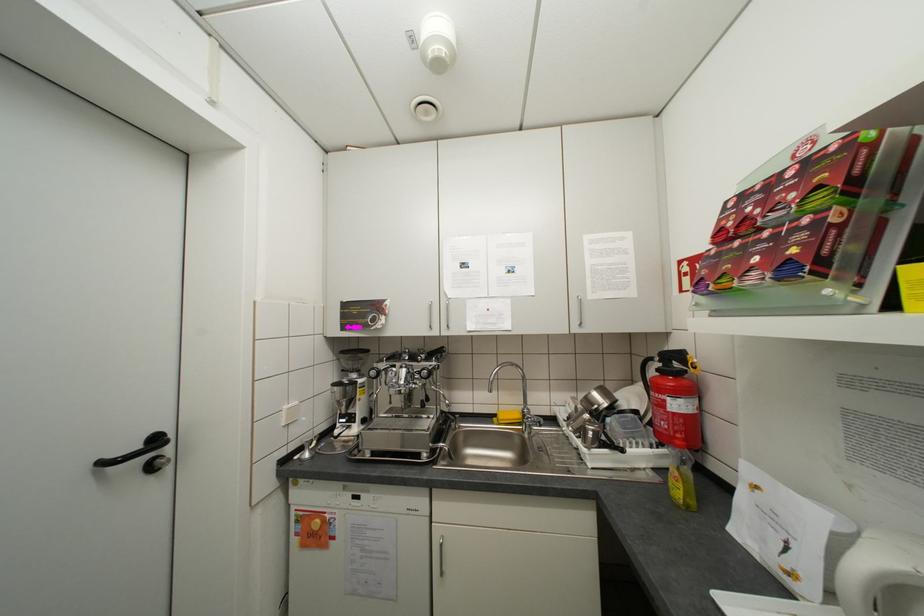
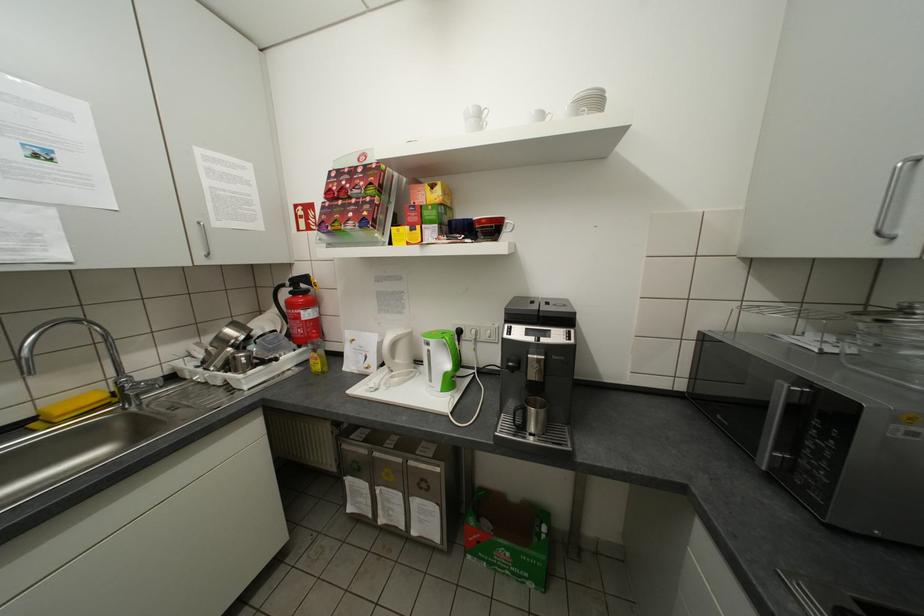
In the second image, find the point that corresponds to point (679, 479) in the first image.

(321, 362)